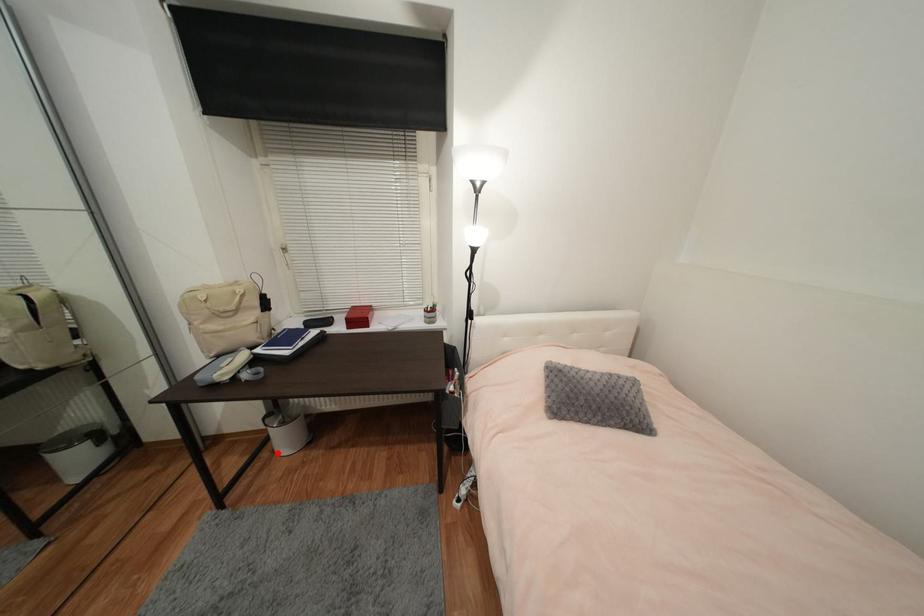
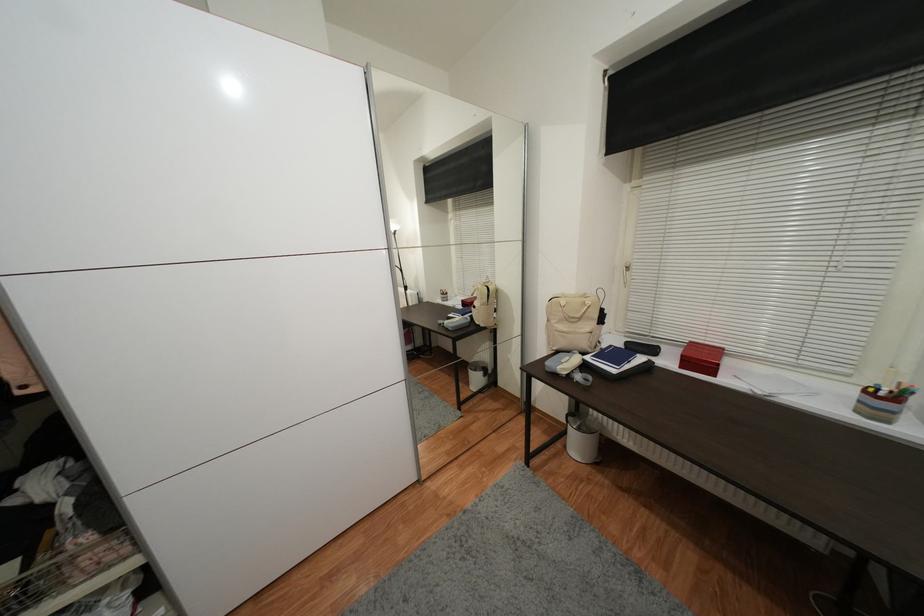
Question: I am providing you with two images of the same scene from different viewpoints. In image1, a red point is highlighted. Considering the same 3D point in image2, which of the following is correct?

Choices:
 (A) It is closer
 (B) It is farther

Answer: (A)